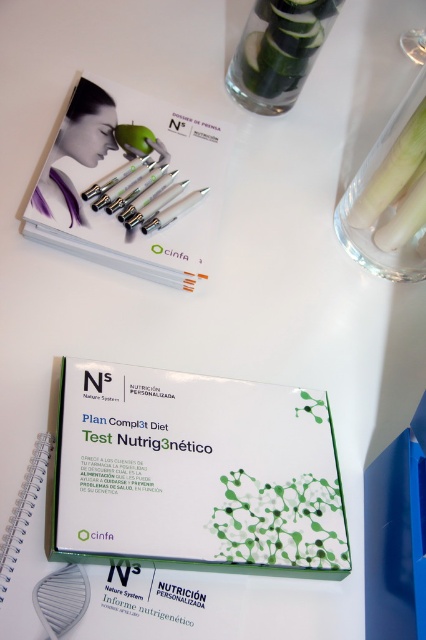
Question: Which object is closer to the camera taking this photo?

Choices:
 (A) clear glass vase at upper right
 (B) white matte box at center
 (C) white matte pen at upper center
 (D) clear plastic pens at upper center

Answer: (B)

Question: Observing the image, what is the correct spatial positioning of clear glass vase at upper right in reference to clear plastic pens at upper center?

Choices:
 (A) above
 (B) below

Answer: (A)

Question: Which of these objects is positioned closest to the white matte box at center?

Choices:
 (A) white matte pen at upper center
 (B) clear plastic pens at upper center
 (C) clear glass vase at upper right
 (D) transparent glass vase at upper right

Answer: (A)

Question: From the image, what is the correct spatial relationship of white matte pen at upper center in relation to clear glass vase at upper right?

Choices:
 (A) above
 (B) below

Answer: (B)

Question: Which point is closer to the camera?

Choices:
 (A) (129, 195)
 (B) (385, 218)
 (C) (259, 93)

Answer: (A)

Question: Considering the relative positions of clear glass vase at upper right and clear plastic pens at upper center in the image provided, where is clear glass vase at upper right located with respect to clear plastic pens at upper center?

Choices:
 (A) left
 (B) right

Answer: (B)